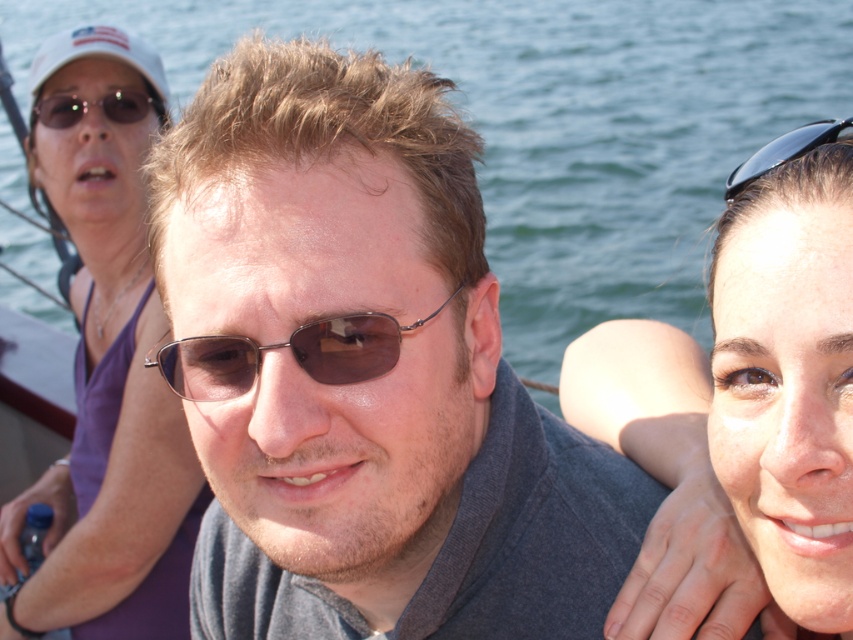
Question: Among these objects, which one is nearest to the camera?

Choices:
 (A) matte black sunglasses at upper left
 (B) smooth skin face at upper right

Answer: (B)

Question: Does smooth skin face at upper right have a smaller size compared to black plastic sunglasses at upper right?

Choices:
 (A) yes
 (B) no

Answer: (B)

Question: Is purple fabric top at upper left behind metallic brown sunglasses at center?

Choices:
 (A) yes
 (B) no

Answer: (A)

Question: Is black plastic sunglasses at upper right bigger than matte black sunglasses at upper left?

Choices:
 (A) yes
 (B) no

Answer: (B)

Question: Considering the real-world distances, which object is closest to the smooth skin face at upper right?

Choices:
 (A) purple fabric top at upper left
 (B) black plastic sunglasses at upper right

Answer: (B)

Question: Which point is farther from the camera taking this photo?

Choices:
 (A) (708, 406)
 (B) (514, 413)

Answer: (A)